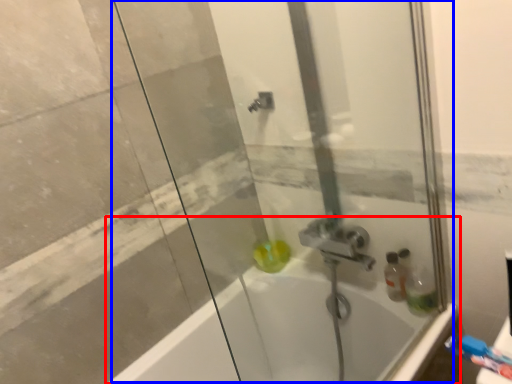
Question: Which object is closer to the camera taking this photo, bathtub (highlighted by a red box) or shower door (highlighted by a blue box)?

Choices:
 (A) bathtub
 (B) shower door

Answer: (B)